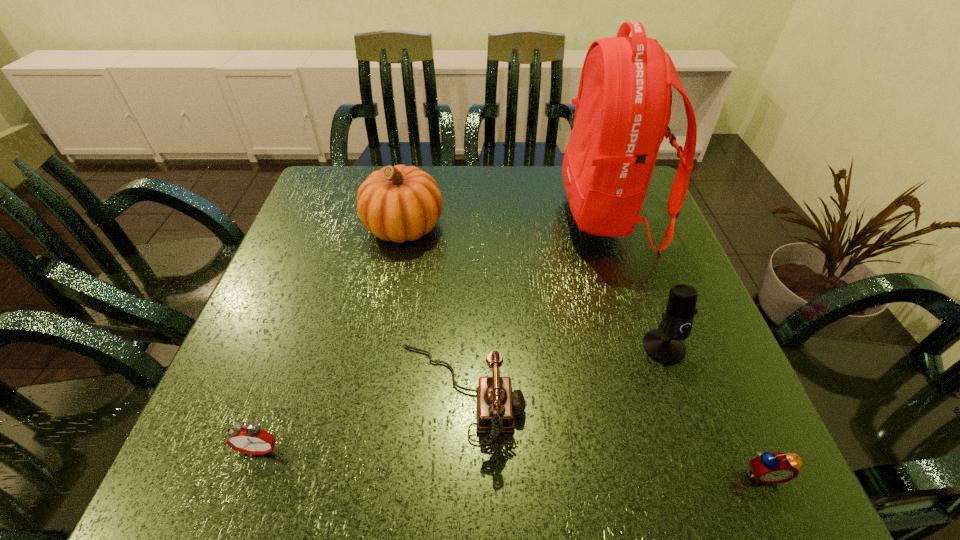
This screenshot has height=540, width=960. In order to click on vacant space that satisfies the following two spatial constraints: 1. on the main compartment of the tallest object; 2. on the front side of the pumpkin in this screenshot , I will do pyautogui.click(x=612, y=227).

At what (x,y) coordinates should I click in order to perform the action: click on free spot that satisfies the following two spatial constraints: 1. on the main compartment of the backpack; 2. on the clock face of the left alarm clock. Please return your answer as a coordinate pair (x, y). Looking at the image, I should click on (685, 449).

Locate an element on the screen. This screenshot has height=540, width=960. free location that satisfies the following two spatial constraints: 1. on the stand of the microphone; 2. on the dial of the third shortest object is located at coordinates (682, 397).

Locate an element on the screen. vacant area that satisfies the following two spatial constraints: 1. on the main compartment of the backpack; 2. on the clock face of the farther alarm clock is located at coordinates (685, 449).